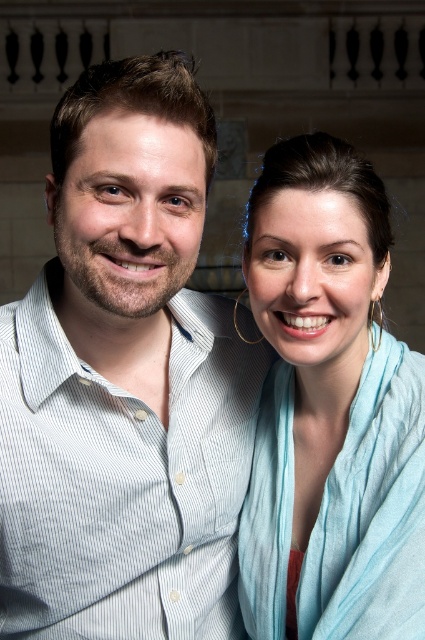
You are a photographer standing at the entrance of a room. You want to take a photo of the light blue silk scarf at right without moving any objects. Can you capture the scarf in your shot if your camera has a 50mm lens? Explain your reasoning.

The light blue silk scarf at right is 23.01 feet from the viewer. A 50mm lens on a full frame camera has a field of view similar to human vision, which can capture objects at that distance clearly without needing to move closer. Therefore, the scarf can be photographed with the 50mm lens without moving any objects.

You are a fashion designer preparing for a photoshoot. You have two light blue items in the image, the light blue silk scarf at right and the light blue striped shirt at center. Which item has a narrower width?

The light blue silk scarf at right is thinner than the light blue striped shirt at center, so the light blue silk scarf at right has a narrower width.

You are standing in a room where the light blue silk scarf at right and the light blue striped shirt at center are both visible. If you want to pick up the scarf without moving closer to the shirt, can you reach it from your current position? The average human arm span is about 3 feet.

The light blue silk scarf at right and the light blue striped shirt at center are 7.49 feet apart. Since the average human arm span is 3 feet, you cannot reach the scarf without moving closer to the shirt as the distance between them exceeds your reach.